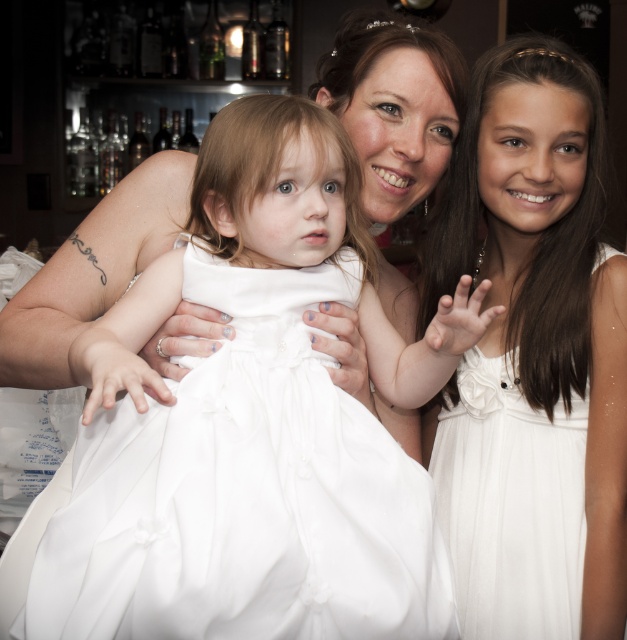
You are standing at the center of the image. Which of the two points, point (213, 161) or point (530, 451), is closer to you?

Point (213, 161) is closer to you because it is in front of point (530, 451).

You are a photographer standing at a certain distance from the white satin dress at center. You want to take a closeup shot of the dress without moving the dress. Can you move closer to the dress to achieve this?

The distance between you and the white satin dress at center is 29.17 inches. Since you can move closer to the dress, you can reduce this distance to achieve a closeup shot.